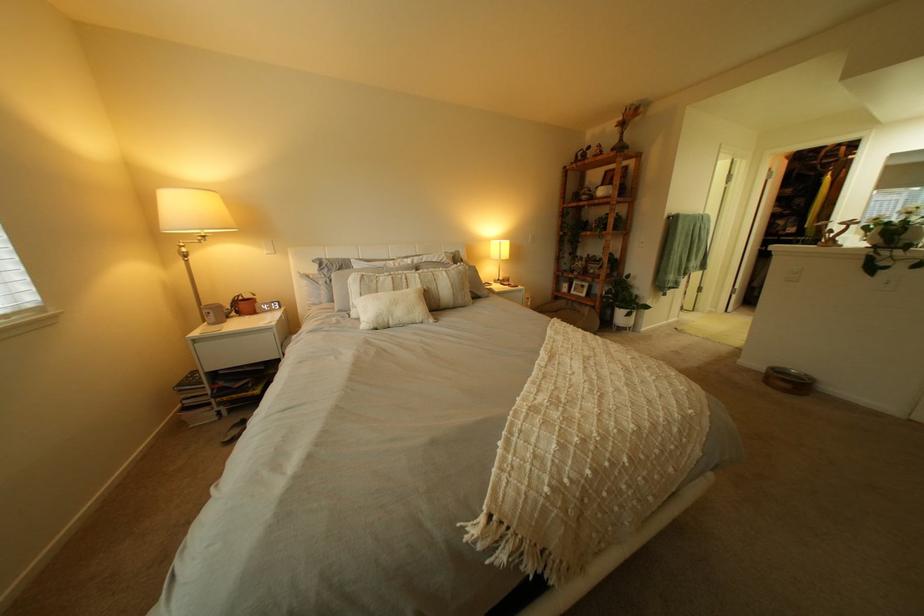
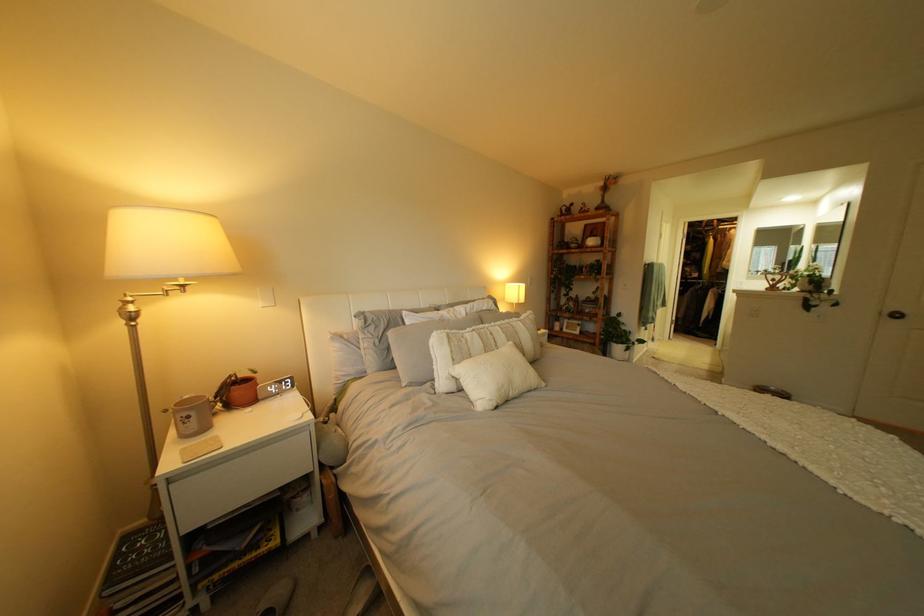
Locate, in the second image, the point that corresponds to (x=196, y=251) in the first image.

(139, 310)